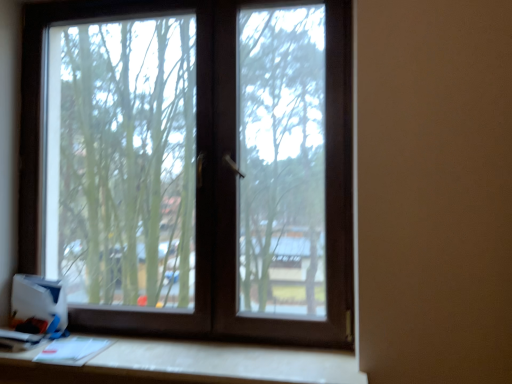
Where is `brown matte window at center`? brown matte window at center is located at coordinates (192, 165).

In order to click on white cardboard box at lower left in this screenshot , I will do `click(39, 304)`.

What is the approximate height of white matte table at lower center?

It is 1.80 inches.

The image size is (512, 384). Describe the element at coordinates (189, 364) in the screenshot. I see `white matte table at lower center` at that location.

Image resolution: width=512 pixels, height=384 pixels. I want to click on brown matte window at center, so click(x=192, y=165).

Considering the relative positions of white matte table at lower center and white cardboard box at lower left in the image provided, is white matte table at lower center in front of white cardboard box at lower left?

Yes.

Can you tell me how much white matte table at lower center and white cardboard box at lower left differ in facing direction?

0.234 degrees.

Is white matte table at lower center next to white cardboard box at lower left?

No, white matte table at lower center is not next to white cardboard box at lower left.

From a real-world perspective, who is located higher, white matte table at lower center or white cardboard box at lower left?

In real-world perspective, white cardboard box at lower left is above.

Is white cardboard box at lower left looking in the opposite direction of white matte table at lower center?

white cardboard box at lower left does not have its back to white matte table at lower center.

Does white cardboard box at lower left lie in front of white matte table at lower center?

No, white cardboard box at lower left is further to the viewer.

Who is smaller, white cardboard box at lower left or white matte table at lower center?

With smaller size is white cardboard box at lower left.

Between white cardboard box at lower left and brown matte window at center, which one has smaller size?

Smaller between the two is white cardboard box at lower left.

Looking at this image, is white cardboard box at lower left far away from brown matte window at center?

No, there isn't a large distance between white cardboard box at lower left and brown matte window at center.

Which object is positioned more to the left, white cardboard box at lower left or brown matte window at center?

From the viewer's perspective, white cardboard box at lower left appears more on the left side.

Could you tell me if brown matte window at center is facing white matte table at lower center?

Yes, brown matte window at center is turned towards white matte table at lower center.

Looking at this image, is the depth of brown matte window at center less than that of white matte table at lower center?

No, brown matte window at center is behind white matte table at lower center.

From the image's perspective, would you say brown matte window at center is positioned over white matte table at lower center?

Yes, from the image's perspective, brown matte window at center is above white matte table at lower center.

From a real-world perspective, is brown matte window at center physically located above or below white cardboard box at lower left?

In terms of real-world spatial position, brown matte window at center is above white cardboard box at lower left.

Would you consider brown matte window at center to be distant from white cardboard box at lower left?

No, brown matte window at center is not far away from white cardboard box at lower left.

Based on the photo, considering the relative positions of brown matte window at center and white cardboard box at lower left in the image provided, is brown matte window at center to the right of white cardboard box at lower left from the viewer's perspective?

Indeed, brown matte window at center is positioned on the right side of white cardboard box at lower left.

Looking at this image, is white matte table at lower center positioned with its back to brown matte window at center?

white matte table at lower center is not turned away from brown matte window at center.

Considering the sizes of white matte table at lower center and brown matte window at center in the image, is white matte table at lower center wider or thinner than brown matte window at center?

Considering their sizes, white matte table at lower center looks broader than brown matte window at center.

Is white matte table at lower center positioned behind brown matte window at center?

No, white matte table at lower center is closer to the camera.

Does white matte table at lower center have a lesser height compared to brown matte window at center?

Correct, white matte table at lower center is not as tall as brown matte window at center.

The width and height of the screenshot is (512, 384). Identify the location of cardboard box located behind the white matte table at lower center. (39, 304).

This screenshot has height=384, width=512. In order to click on cardboard box above the white matte table at lower center (from the image's perspective) in this screenshot , I will do `click(39, 304)`.

Which object lies nearer to the anchor point white cardboard box at lower left, brown matte window at center or white matte table at lower center?

white matte table at lower center lies closer to white cardboard box at lower left than the other object.

Based on their spatial positions, is brown matte window at center or white cardboard box at lower left closer to white matte table at lower center?

white cardboard box at lower left.

Considering their positions, is white matte table at lower center positioned closer to brown matte window at center than white cardboard box at lower left?

white matte table at lower center is positioned closer to the anchor brown matte window at center.

Based on their spatial positions, is white cardboard box at lower left or brown matte window at center closer to white matte table at lower center?

Among the two, white cardboard box at lower left is located nearer to white matte table at lower center.

When comparing their distances from white cardboard box at lower left, does white matte table at lower center or brown matte window at center seem further?

brown matte window at center lies further to white cardboard box at lower left than the other object.

Based on their spatial positions, is white cardboard box at lower left or white matte table at lower center further from brown matte window at center?

white cardboard box at lower left.

You are a GUI agent. You are given a task and a screenshot of the screen. Output one action in this format:
    pyautogui.click(x=<x>, y=<y>)
    Task: Click on the cardboard box between brown matte window at center and white matte table at lower center vertically
    
    Given the screenshot: What is the action you would take?
    pyautogui.click(x=39, y=304)